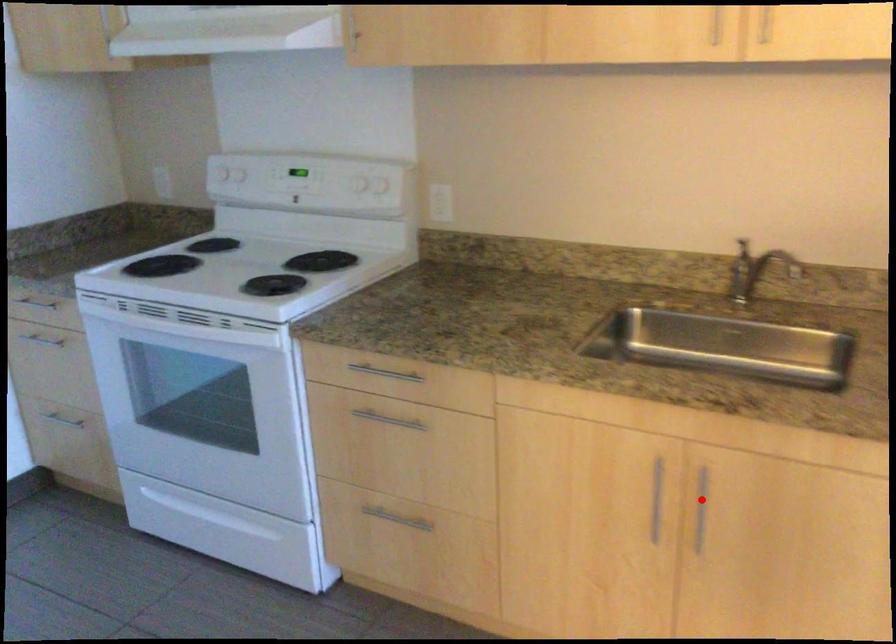
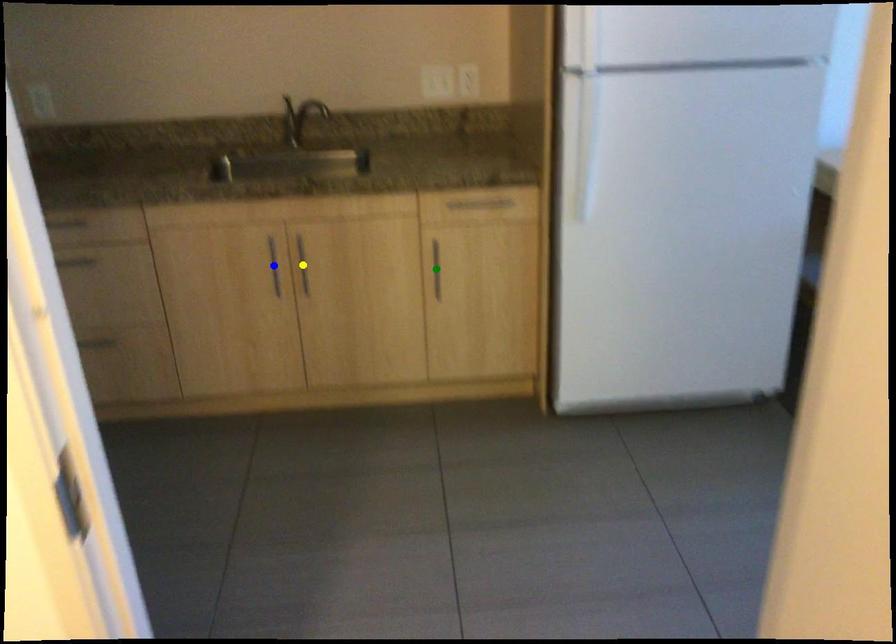
Question: I am providing you with two images of the same scene from different viewpoints. A red point is marked on the first image. You are given multiple points on the second image. Which spot in image 2 lines up with the point in image 1?

Choices:
 (A) green point
 (B) blue point
 (C) yellow point

Answer: (C)